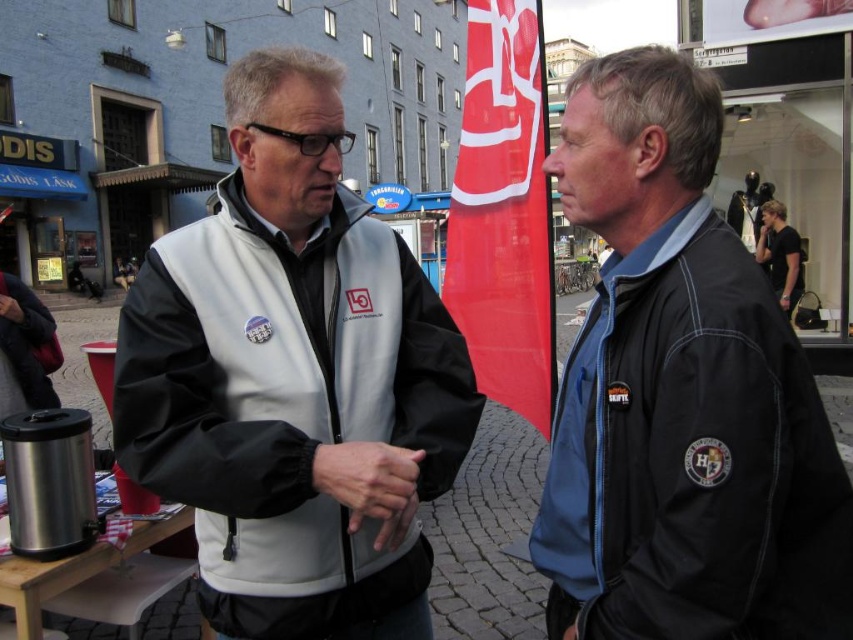
You are standing at the point with coordinates point [683,532] and want to walk to the point with coordinates point [219,400]. Based on the spatial relationship between these two points, will you have to walk towards or away from the buildings in the background?

Point [219,400] is behind point [683,532], so walking to it would mean moving away from the buildings in the background.